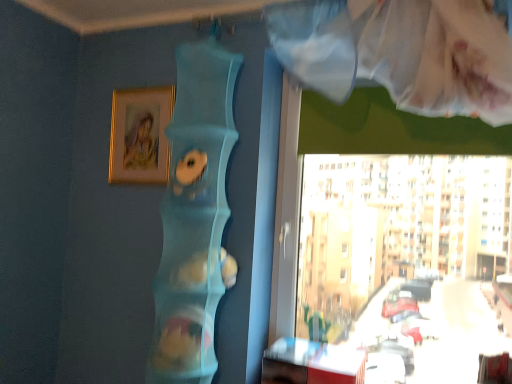
Find the location of a particular element. empty space that is ontop of wooden table at lower right (from a real-world perspective) is located at coordinates (294, 344).